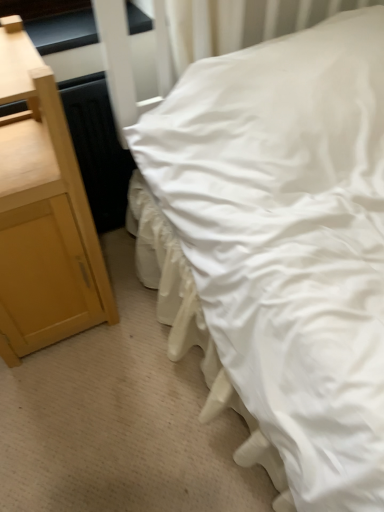
This screenshot has width=384, height=512. In order to click on unoccupied area in front of light wood/texture nightstand at left in this screenshot , I will do `click(66, 404)`.